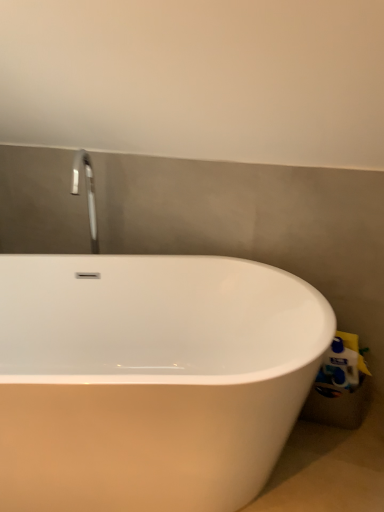
Measure the distance between point (94, 255) and camera.

Point (94, 255) is 1.71 meters away from camera.

Find the location of a particular element. Image resolution: width=384 pixels, height=512 pixels. white glossy bathtub at center is located at coordinates (150, 378).

Describe the element at coordinates (150, 378) in the screenshot. I see `white glossy bathtub at center` at that location.

What do you see at coordinates (341, 366) in the screenshot? I see `white plastic toilet paper at lower right` at bounding box center [341, 366].

Where is `white plastic toilet paper at lower right`? This screenshot has height=512, width=384. white plastic toilet paper at lower right is located at coordinates (341, 366).

The image size is (384, 512). Find the location of `white glossy bathtub at center`. white glossy bathtub at center is located at coordinates (150, 378).

Considering the relative positions of white glossy bathtub at center and white plastic toilet paper at lower right in the image provided, is white glossy bathtub at center to the right of white plastic toilet paper at lower right from the viewer's perspective?

Incorrect, white glossy bathtub at center is not on the right side of white plastic toilet paper at lower right.

In the scene shown: Is white glossy bathtub at center positioned behind white plastic toilet paper at lower right?

No, it is not.

Is point (37, 329) closer to viewer compared to point (344, 347)?

No.

From the image's perspective, is white glossy bathtub at center over white plastic toilet paper at lower right?

No.

From a real-world perspective, is white glossy bathtub at center on white plastic toilet paper at lower right?

No, from a real-world perspective, white glossy bathtub at center is not over white plastic toilet paper at lower right

Considering the relative sizes of white glossy bathtub at center and white plastic toilet paper at lower right in the image provided, is white glossy bathtub at center thinner than white plastic toilet paper at lower right?

No, white glossy bathtub at center is not thinner than white plastic toilet paper at lower right.

Based on the photo, in terms of height, does white glossy bathtub at center look taller or shorter compared to white plastic toilet paper at lower right?

white glossy bathtub at center is taller than white plastic toilet paper at lower right.

Considering the sizes of objects white glossy bathtub at center and white plastic toilet paper at lower right in the image provided, who is smaller, white glossy bathtub at center or white plastic toilet paper at lower right?

white plastic toilet paper at lower right.

Is white glossy bathtub at center inside the boundaries of white plastic toilet paper at lower right, or outside?

The correct answer is: outside.

Is white glossy bathtub at center beside white plastic toilet paper at lower right?

No, white glossy bathtub at center is not beside white plastic toilet paper at lower right.

Does white glossy bathtub at center turn towards white plastic toilet paper at lower right?

No, white glossy bathtub at center is not aimed at white plastic toilet paper at lower right.

What's the angular difference between white glossy bathtub at center and white plastic toilet paper at lower right's facing directions?

They differ by 23 degrees in their facing directions.

Find the location of a particular element. Image resolution: width=384 pixels, height=512 pixels. toilet paper located above the white glossy bathtub at center (from a real-world perspective) is located at coordinates coord(341,366).

Can you confirm if white plastic toilet paper at lower right is positioned to the right of white glossy bathtub at center?

Yes, white plastic toilet paper at lower right is to the right of white glossy bathtub at center.

Which object is further away from the camera, white plastic toilet paper at lower right or white glossy bathtub at center?

Positioned behind is white plastic toilet paper at lower right.

Which is nearer, (337, 384) or (63, 378)?

Point (337, 384) is positioned farther from the camera compared to point (63, 378).

From the image's perspective, is white plastic toilet paper at lower right under white glossy bathtub at center?

Actually, white plastic toilet paper at lower right appears above white glossy bathtub at center in the image.

From a real-world perspective, is white plastic toilet paper at lower right positioned over white glossy bathtub at center based on gravity?

Correct, in the physical world, white plastic toilet paper at lower right is higher than white glossy bathtub at center.

Considering the sizes of objects white plastic toilet paper at lower right and white glossy bathtub at center in the image provided, who is wider, white plastic toilet paper at lower right or white glossy bathtub at center?

With larger width is white glossy bathtub at center.

Who is taller, white plastic toilet paper at lower right or white glossy bathtub at center?

With more height is white glossy bathtub at center.

Does white plastic toilet paper at lower right have a larger size compared to white glossy bathtub at center?

Incorrect, white plastic toilet paper at lower right is not larger than white glossy bathtub at center.

Choose the correct answer: Is white plastic toilet paper at lower right inside white glossy bathtub at center or outside it?

white plastic toilet paper at lower right is not enclosed by white glossy bathtub at center.

Is white plastic toilet paper at lower right far away from white glossy bathtub at center?

No.

Is white glossy bathtub at center at the back of white plastic toilet paper at lower right?

No, white plastic toilet paper at lower right is not facing away from white glossy bathtub at center.

Identify the location of bathtub that is below the white plastic toilet paper at lower right (from the image's perspective). The width and height of the screenshot is (384, 512). (150, 378).

Image resolution: width=384 pixels, height=512 pixels. I want to click on bathtub to the left of white plastic toilet paper at lower right, so click(x=150, y=378).

Locate an element on the screen. bathtub below the white plastic toilet paper at lower right (from the image's perspective) is located at coordinates (150, 378).